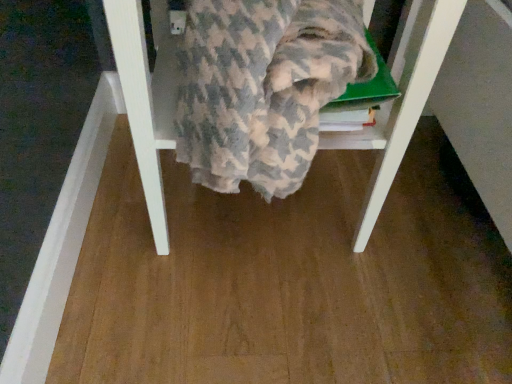
This screenshot has height=384, width=512. I want to click on vacant space to the right of textured fabric blanket at center, so click(438, 237).